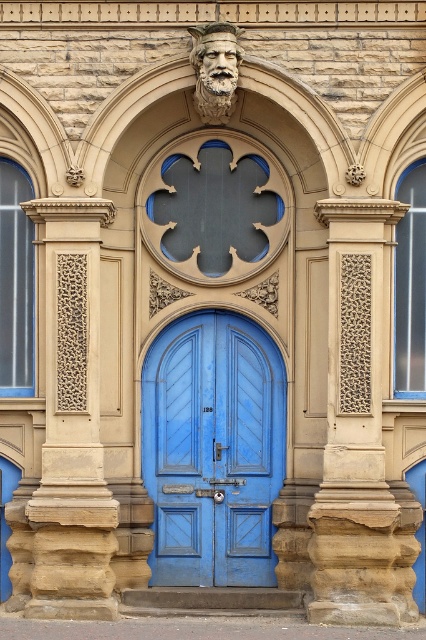
You are an architect analyzing the building facade. You notice the beige textured stone pillar at center and the sandstone textured column at left. Which one is bigger in size?

The beige textured stone pillar at center has a larger size compared to the sandstone textured column at left, so the beige textured stone pillar at center is bigger.

You are an architect assessing the symmetry of the building entrance. Given the presence of the matte blue door at center and the beige textured stone pillar at center, which object is wider according to the provided description?

The matte blue door at center might be wider than beige textured stone pillar at center according to the description.

You are an architect reviewing the building plans. You need to place a new decorative element at point (359, 440). What object is already present at this location?

The beige textured stone pillar at center is located at point (359, 440).